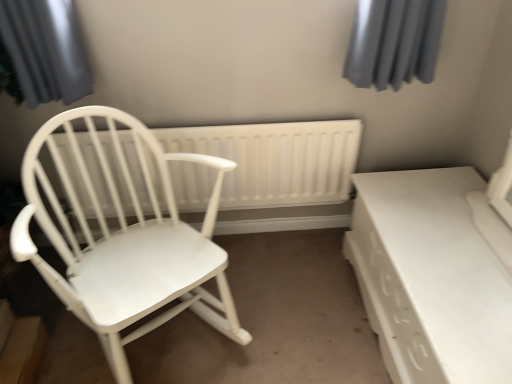
Question: Considering the relative sizes of white matte wood chair at left and white plastic radiator at center in the image provided, is white matte wood chair at left wider than white plastic radiator at center?

Choices:
 (A) yes
 (B) no

Answer: (A)

Question: Does white matte wood chair at left come behind white plastic radiator at center?

Choices:
 (A) no
 (B) yes

Answer: (A)

Question: Can you confirm if white matte wood chair at left is thinner than white plastic radiator at center?

Choices:
 (A) no
 (B) yes

Answer: (A)

Question: Can you confirm if white matte wood chair at left is bigger than white plastic radiator at center?

Choices:
 (A) yes
 (B) no

Answer: (A)

Question: Does white matte wood chair at left have a lesser height compared to white plastic radiator at center?

Choices:
 (A) no
 (B) yes

Answer: (A)

Question: From the image's perspective, is white matte wood chair at left positioned above or below white glossy table at lower right?

Choices:
 (A) above
 (B) below

Answer: (A)

Question: Is white matte wood chair at left bigger or smaller than white glossy table at lower right?

Choices:
 (A) small
 (B) big

Answer: (B)

Question: Is point (114, 329) positioned closer to the camera than point (353, 253)?

Choices:
 (A) farther
 (B) closer

Answer: (B)

Question: Is white matte wood chair at left in front of or behind white glossy table at lower right in the image?

Choices:
 (A) behind
 (B) front

Answer: (B)

Question: Based on their sizes in the image, would you say white glossy table at lower right is bigger or smaller than white matte wood chair at left?

Choices:
 (A) small
 (B) big

Answer: (A)

Question: From the image's perspective, is white glossy table at lower right above or below white matte wood chair at left?

Choices:
 (A) below
 (B) above

Answer: (A)

Question: Is white glossy table at lower right to the left or to the right of white matte wood chair at left in the image?

Choices:
 (A) right
 (B) left

Answer: (A)

Question: Does point (365, 190) appear closer or farther from the camera than point (211, 271)?

Choices:
 (A) farther
 (B) closer

Answer: (A)

Question: From the image's perspective, is white plastic radiator at center positioned above or below white matte wood chair at left?

Choices:
 (A) below
 (B) above

Answer: (B)

Question: Is white plastic radiator at center spatially inside white matte wood chair at left, or outside of it?

Choices:
 (A) outside
 (B) inside

Answer: (A)